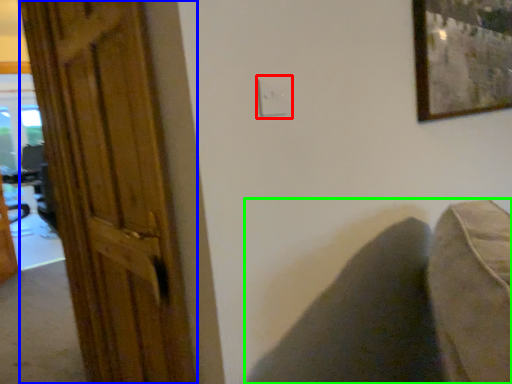
Question: Which object is positioned farthest from electric outlet (highlighted by a red box)? Select from door (highlighted by a blue box) and swivel chair (highlighted by a green box).

Choices:
 (A) door
 (B) swivel chair

Answer: (A)